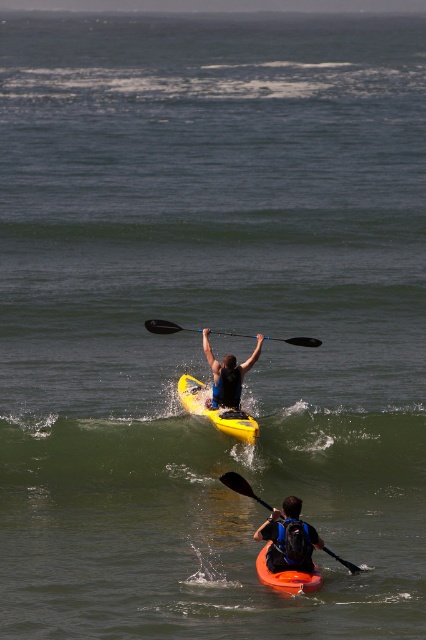
Question: Does matte black kayak at center have a greater width compared to orange matte canoe at lower center?

Choices:
 (A) yes
 (B) no

Answer: (A)

Question: Among these points, which one is farthest from the camera?

Choices:
 (A) (224, 356)
 (B) (149, 438)
 (C) (229, 417)
 (D) (247, 337)

Answer: (D)

Question: Does matte black backpack at lower center have a larger size compared to black plastic paddle at center?

Choices:
 (A) no
 (B) yes

Answer: (A)

Question: Which point is farther to the camera?

Choices:
 (A) (184, 326)
 (B) (224, 392)
 (C) (232, 422)
 (D) (184, 486)

Answer: (A)

Question: Estimate the real-world distances between objects in this image. Which object is closer to the yellow matte kayak at center?

Choices:
 (A) black plastic paddle at center
 (B) black plastic paddle at lower center
 (C) orange matte canoe at lower center

Answer: (A)

Question: Does matte black backpack at lower center come in front of matte black kayak at center?

Choices:
 (A) yes
 (B) no

Answer: (A)